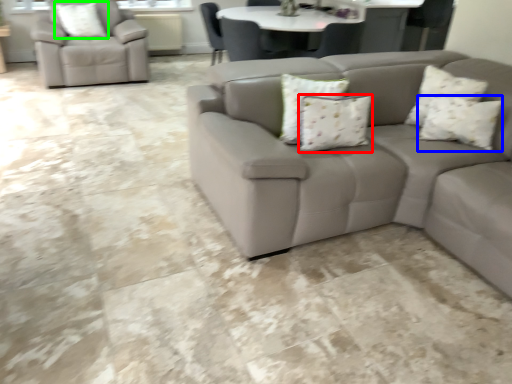
Question: Which object is positioned farthest from pillow (highlighted by a red box)? Select from pillow (highlighted by a blue box) and pillow (highlighted by a green box).

Choices:
 (A) pillow
 (B) pillow

Answer: (B)